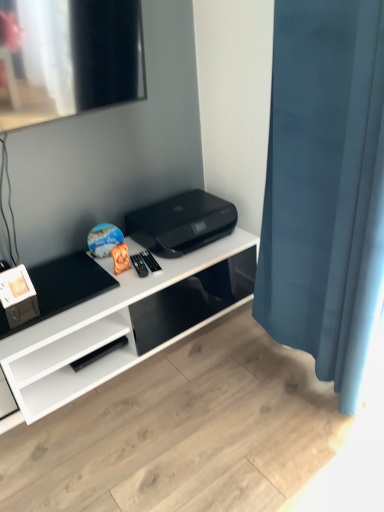
Where is `free space in front of black plastic printer at center`? free space in front of black plastic printer at center is located at coordinates (170, 269).